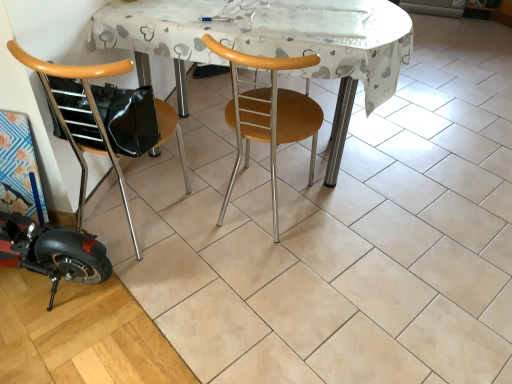
Question: Is woodenwoodenchair at center, which is the first chair from right to left, far from woodenchair at left, positioned as the first chair in left-to-right order?

Choices:
 (A) yes
 (B) no

Answer: (B)

Question: From the image's perspective, is woodenwoodenchair at center, which ranks as the second chair in left-to-right order, located above woodenchair at left, positioned as the first chair in left-to-right order?

Choices:
 (A) yes
 (B) no

Answer: (A)

Question: From the image's perspective, is woodenwoodenchair at center, which is the first chair from right to left, under woodenchair at left, positioned as the 2th chair in right-to-left order?

Choices:
 (A) no
 (B) yes

Answer: (A)

Question: Can you confirm if woodenwoodenchair at center, which is the first chair from right to left, is wider than woodenchair at left, positioned as the 2th chair in right-to-left order?

Choices:
 (A) yes
 (B) no

Answer: (B)

Question: Is woodenwoodenchair at center, which is the first chair from right to left, oriented away from woodenchair at left, positioned as the 2th chair in right-to-left order?

Choices:
 (A) no
 (B) yes

Answer: (A)

Question: Is woodenwoodenchair at center, which ranks as the second chair in left-to-right order, in front of or behind white plastic table at center in the image?

Choices:
 (A) front
 (B) behind

Answer: (A)

Question: Considering the positions of woodenwoodenchair at center, which is the first chair from right to left, and white plastic table at center in the image, is woodenwoodenchair at center, which is the first chair from right to left, wider or thinner than white plastic table at center?

Choices:
 (A) wide
 (B) thin

Answer: (B)

Question: Is woodenwoodenchair at center, which ranks as the second chair in left-to-right order, bigger or smaller than white plastic table at center?

Choices:
 (A) small
 (B) big

Answer: (A)

Question: Considering the positions of woodenwoodenchair at center, which ranks as the second chair in left-to-right order, and white plastic table at center in the image, is woodenwoodenchair at center, which ranks as the second chair in left-to-right order, taller or shorter than white plastic table at center?

Choices:
 (A) short
 (B) tall

Answer: (B)

Question: Considering the positions of woodenwoodenchair at center, which is the first chair from right to left, and woodenchair at left, positioned as the 2th chair in right-to-left order, in the image, is woodenwoodenchair at center, which is the first chair from right to left, wider or thinner than woodenchair at left, positioned as the 2th chair in right-to-left order,?

Choices:
 (A) wide
 (B) thin

Answer: (B)

Question: Considering the positions of woodenwoodenchair at center, which is the first chair from right to left, and woodenchair at left, positioned as the first chair in left-to-right order, in the image, is woodenwoodenchair at center, which is the first chair from right to left, bigger or smaller than woodenchair at left, positioned as the first chair in left-to-right order,?

Choices:
 (A) small
 (B) big

Answer: (B)

Question: Is woodenwoodenchair at center, which ranks as the second chair in left-to-right order, spatially inside woodenchair at left, positioned as the 2th chair in right-to-left order, or outside of it?

Choices:
 (A) inside
 (B) outside

Answer: (B)

Question: Is point (274, 183) positioned closer to the camera than point (141, 120)?

Choices:
 (A) closer
 (B) farther

Answer: (B)

Question: Considering their positions, is woodenchair at left, positioned as the first chair in left-to-right order, located in front of or behind white plastic table at center?

Choices:
 (A) behind
 (B) front

Answer: (B)

Question: Considering the positions of woodenchair at left, positioned as the 2th chair in right-to-left order, and white plastic table at center in the image, is woodenchair at left, positioned as the 2th chair in right-to-left order, taller or shorter than white plastic table at center?

Choices:
 (A) tall
 (B) short

Answer: (A)